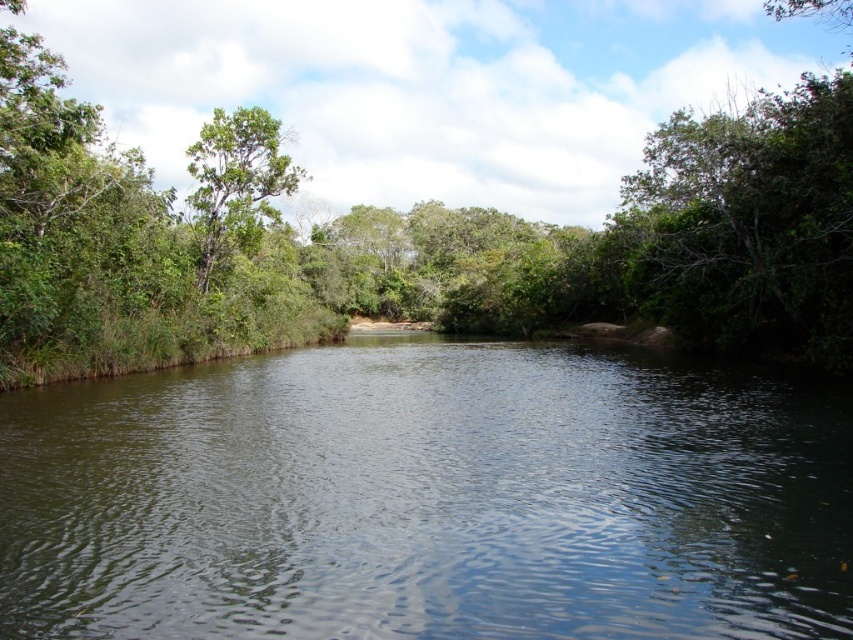
Is dark green water at center below green leafy tree at center?

Yes.

The height and width of the screenshot is (640, 853). What do you see at coordinates (428, 499) in the screenshot?
I see `dark green water at center` at bounding box center [428, 499].

Image resolution: width=853 pixels, height=640 pixels. Identify the location of dark green water at center. point(428,499).

Identify the location of green leafy tree at center. The height and width of the screenshot is (640, 853). (409, 237).

Which is more to the right, dark green water at center or green leafy tree at upper left?

dark green water at center

Is dark green water at center to the left of green leafy tree at upper left from the viewer's perspective?

Incorrect, dark green water at center is not on the left side of green leafy tree at upper left.

Which is behind, point (579, 348) or point (250, 202)?

The point (579, 348) is more distant.

Image resolution: width=853 pixels, height=640 pixels. Find the location of `dark green water at center`. dark green water at center is located at coordinates (428, 499).